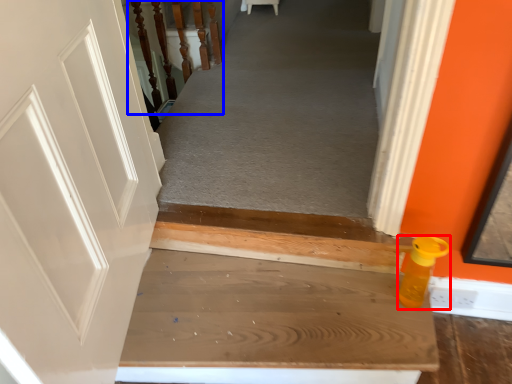
Question: Which object appears closest to the camera in this image, bottle (highlighted by a red box) or rail (highlighted by a blue box)?

Choices:
 (A) bottle
 (B) rail

Answer: (A)